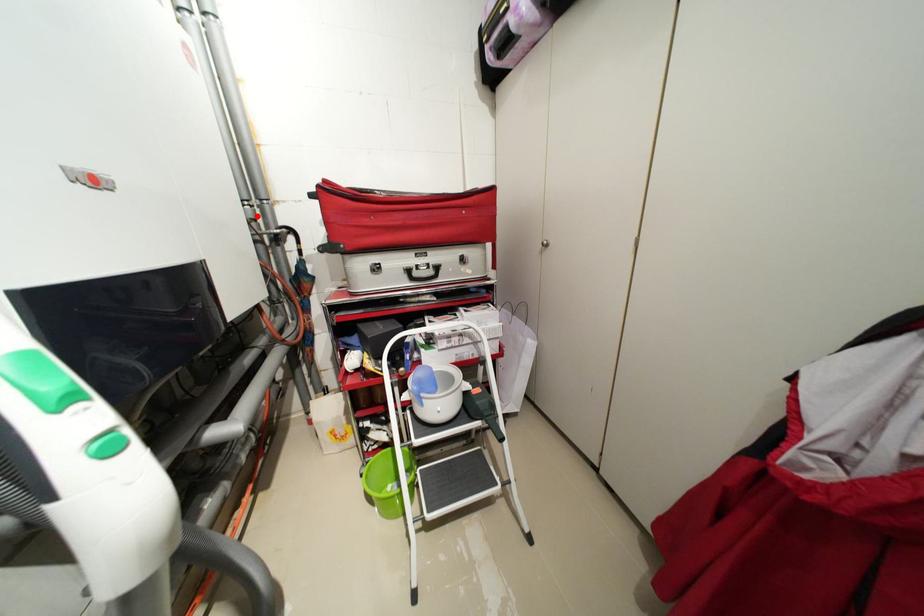
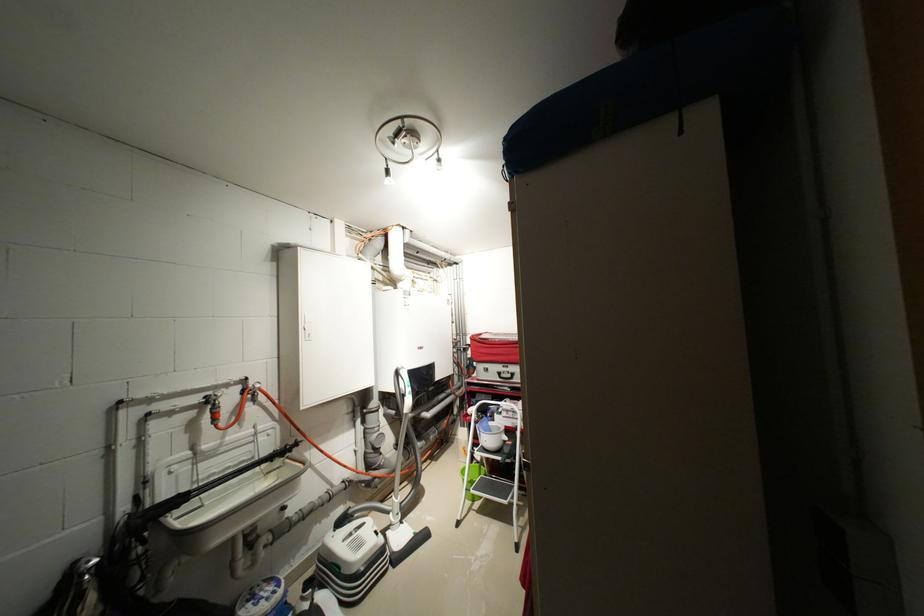
Locate, in the second image, the point that corresponds to the highlighted location in the first image.

(466, 341)